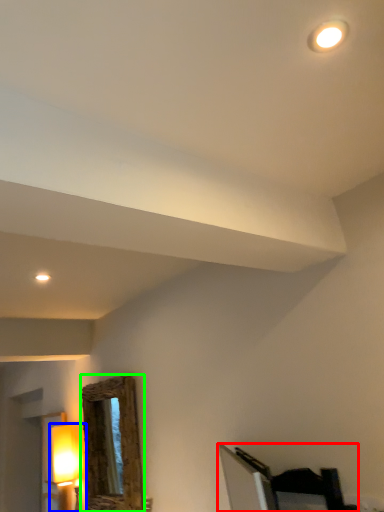
Question: Estimate the real-world distances between objects in this image. Which object is farther from furniture (highlighted by a red box), lamp (highlighted by a blue box) or mirror (highlighted by a green box)?

Choices:
 (A) lamp
 (B) mirror

Answer: (A)